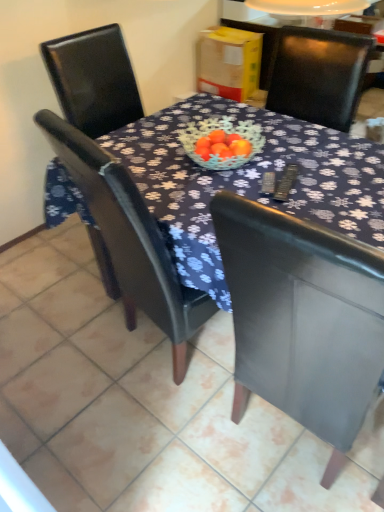
Image resolution: width=384 pixels, height=512 pixels. In order to click on free space in front of matte black chair at center, marked as the 1th chair in a left-to-right arrangement in this screenshot , I will do `click(138, 452)`.